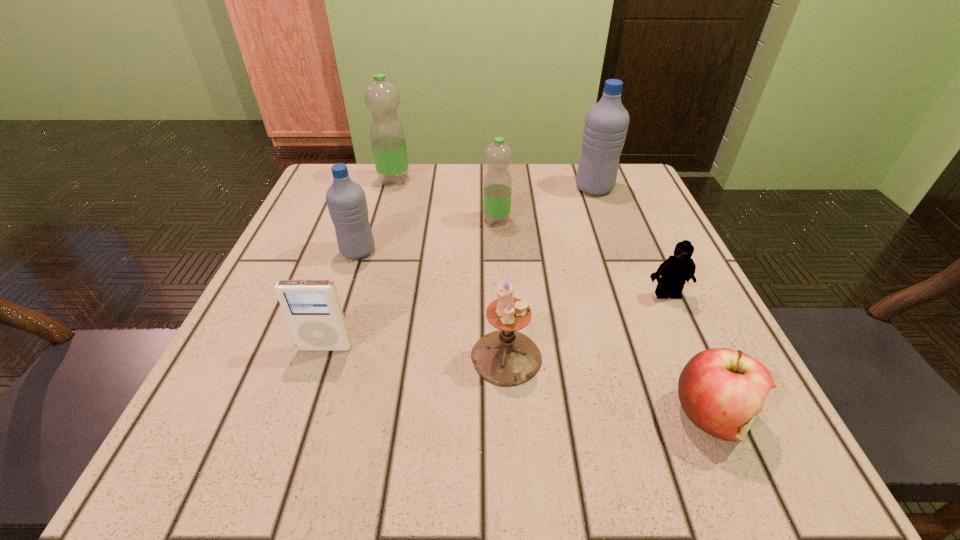
Image resolution: width=960 pixels, height=540 pixels. I want to click on free space located 0.080m on the back of the apple, so click(x=678, y=339).

The image size is (960, 540). I want to click on object that is positioned at the near edge, so click(722, 391).

The height and width of the screenshot is (540, 960). I want to click on iPod that is at the left edge, so click(x=312, y=308).

I want to click on water bottle located in the right edge section of the desktop, so click(x=606, y=123).

Locate an element on the screen. The width and height of the screenshot is (960, 540). Lego present at the right edge is located at coordinates (678, 268).

You are a GUI agent. You are given a task and a screenshot of the screen. Output one action in this format:
    pyautogui.click(x=<x>, y=<y>)
    Task: Click on the apple located at the right edge
    
    Given the screenshot: What is the action you would take?
    pyautogui.click(x=722, y=391)

This screenshot has width=960, height=540. I want to click on object that is at the far left corner, so click(x=387, y=134).

At what (x,y) coordinates should I click in order to perform the action: click on object positioned at the far right corner. Please return your answer as a coordinate pair (x, y). The image size is (960, 540). Looking at the image, I should click on (606, 123).

The image size is (960, 540). I want to click on object located at the near right corner, so click(722, 391).

The height and width of the screenshot is (540, 960). In the image, there is a desktop. Identify the location of vacant space at the far edge. (553, 165).